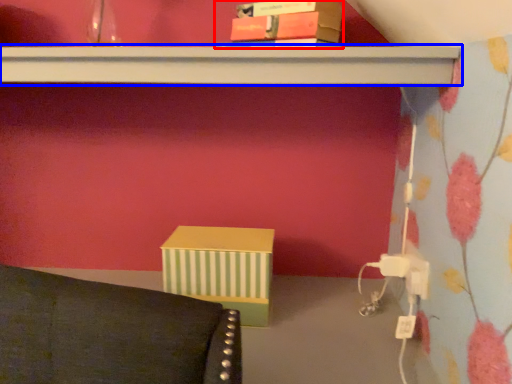
Question: Which point is closer to the camera, book (highlighted by a red box) or shelf (highlighted by a blue box)?

Choices:
 (A) book
 (B) shelf

Answer: (B)